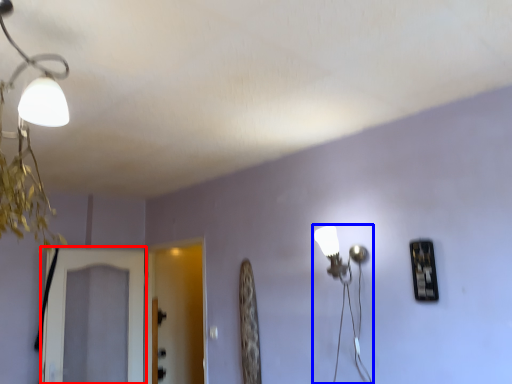
Question: Which of the following is the closest to the observer, screen door (highlighted by a red box) or lamp (highlighted by a blue box)?

Choices:
 (A) screen door
 (B) lamp

Answer: (B)